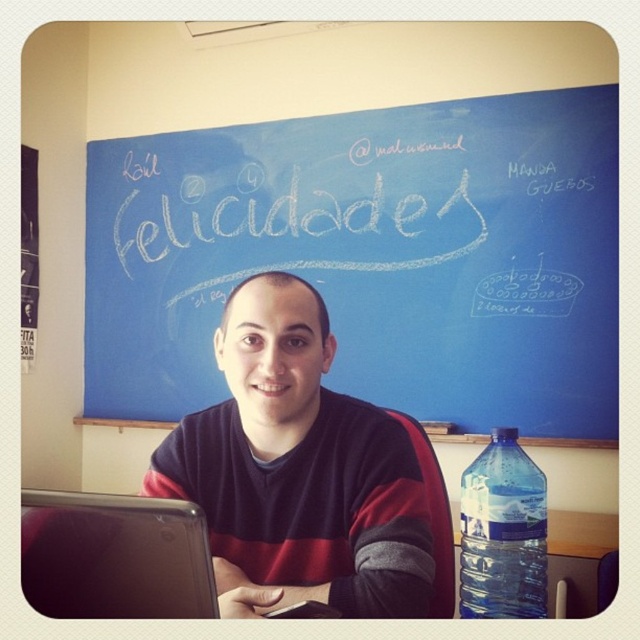
Question: Which of the following is the farthest from the observer?

Choices:
 (A) striped sweater at center
 (B) white chalk writing at upper center
 (C) translucent plastic water bottle at right
 (D) silver metallic laptop at lower left

Answer: (B)

Question: Considering the real-world distances, which object is farthest from the translucent plastic water bottle at lower right?

Choices:
 (A) silver metallic laptop at lower left
 (B) translucent plastic table at lower right
 (C) white chalk writing at upper center

Answer: (C)

Question: Is translucent plastic water bottle at right bigger than translucent plastic table at lower right?

Choices:
 (A) no
 (B) yes

Answer: (A)

Question: Observing the image, what is the correct spatial positioning of silver metallic laptop at lower left in reference to translucent plastic water bottle at lower right?

Choices:
 (A) left
 (B) right

Answer: (A)

Question: Can you confirm if translucent plastic water bottle at right is bigger than translucent plastic table at lower right?

Choices:
 (A) yes
 (B) no

Answer: (B)

Question: Which of these objects is positioned closest to the translucent plastic water bottle at right?

Choices:
 (A) blue chalkboard at upper center
 (B) translucent plastic table at lower right

Answer: (B)